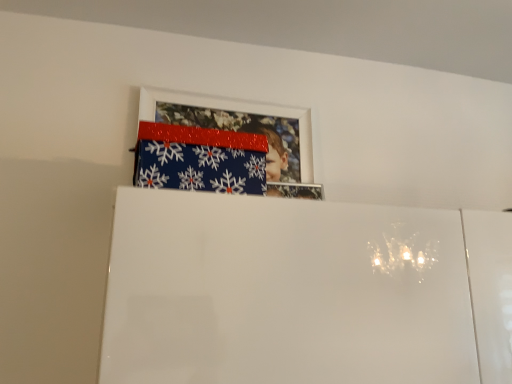
Locate an element on the screen. The image size is (512, 384). matte white picture frame at upper center is located at coordinates (247, 132).

The height and width of the screenshot is (384, 512). Describe the element at coordinates (247, 132) in the screenshot. I see `matte white picture frame at upper center` at that location.

The image size is (512, 384). What are the coordinates of `matte white picture frame at upper center` in the screenshot? It's located at (247, 132).